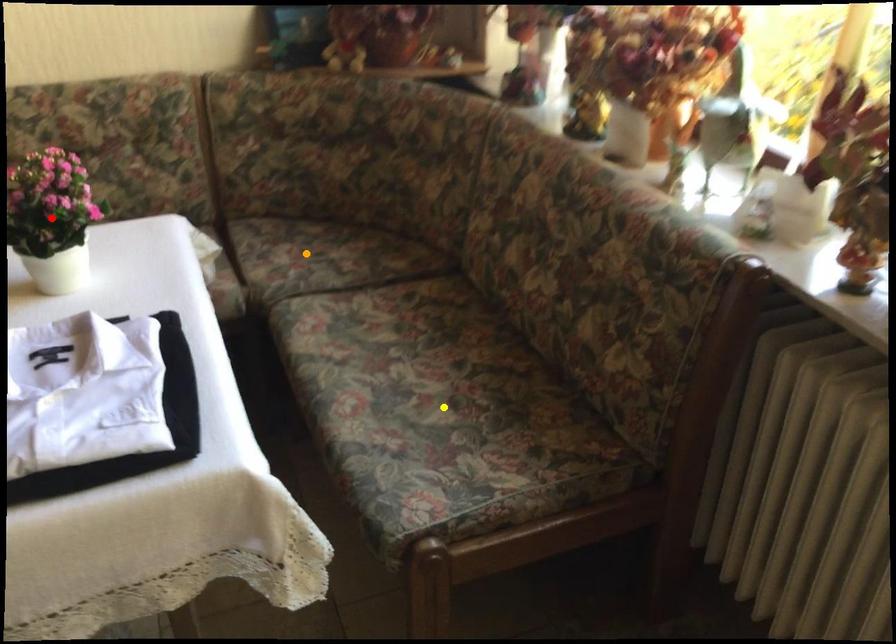
Order these from nearest to farthest:
1. red point
2. orange point
3. yellow point

red point < yellow point < orange point